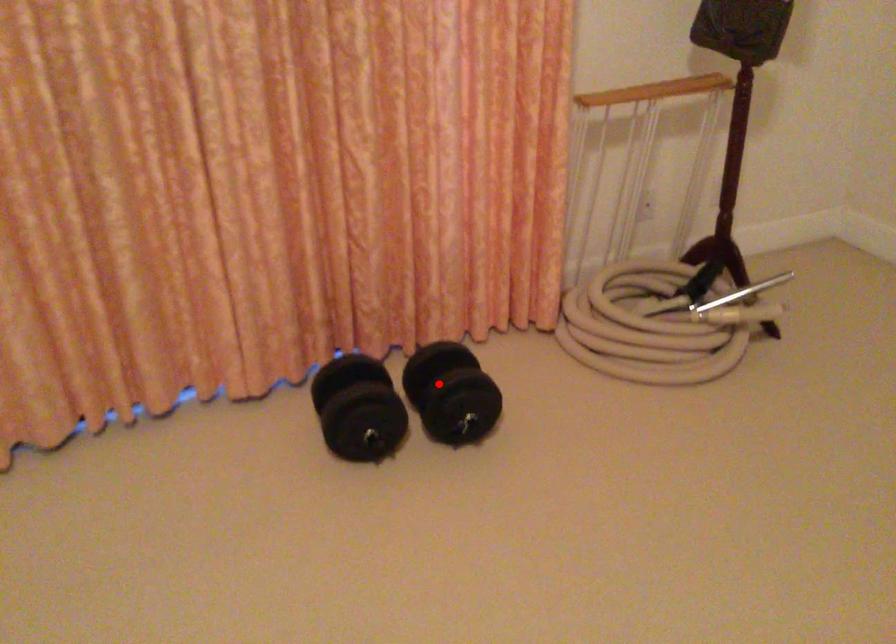
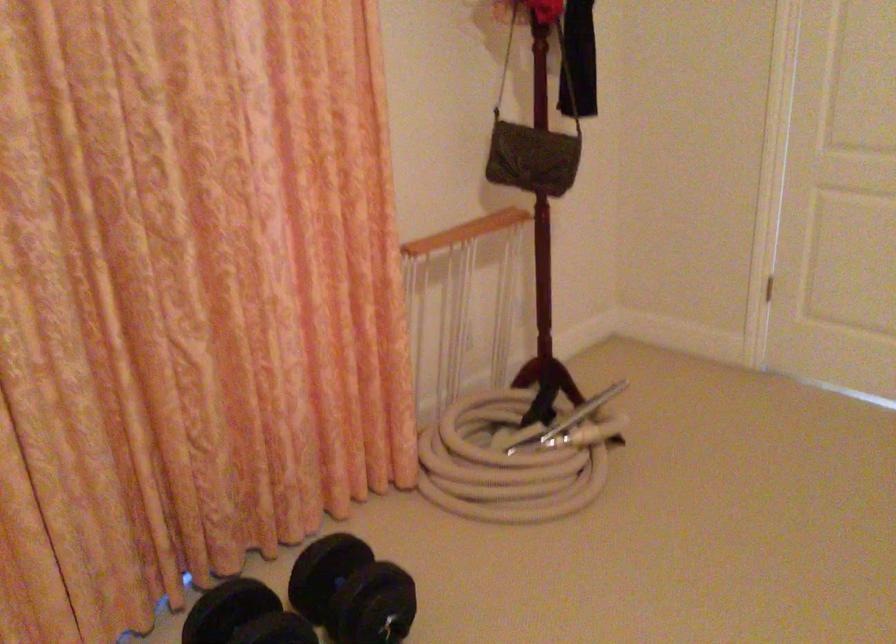
In the second image, find the point that corresponds to the highlighted location in the first image.

(351, 591)